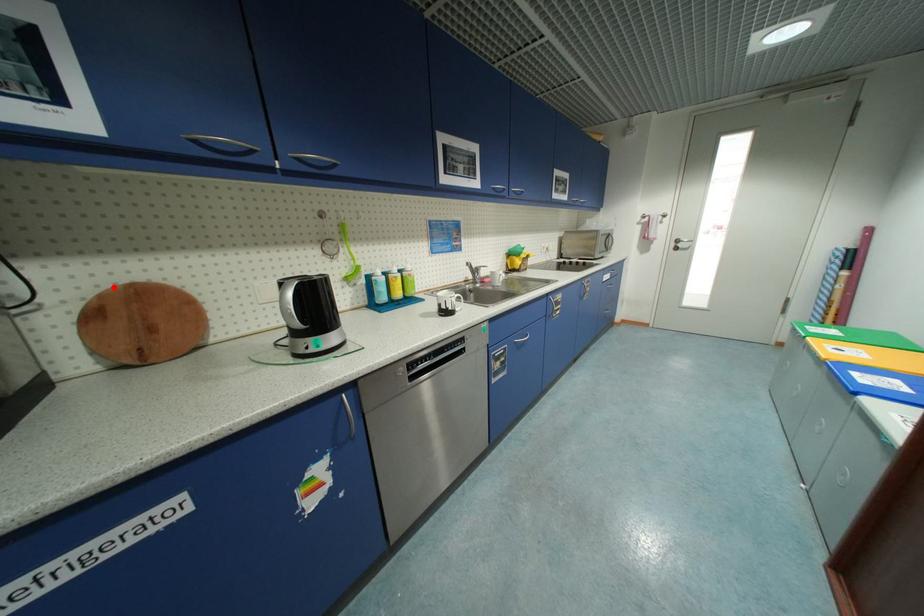
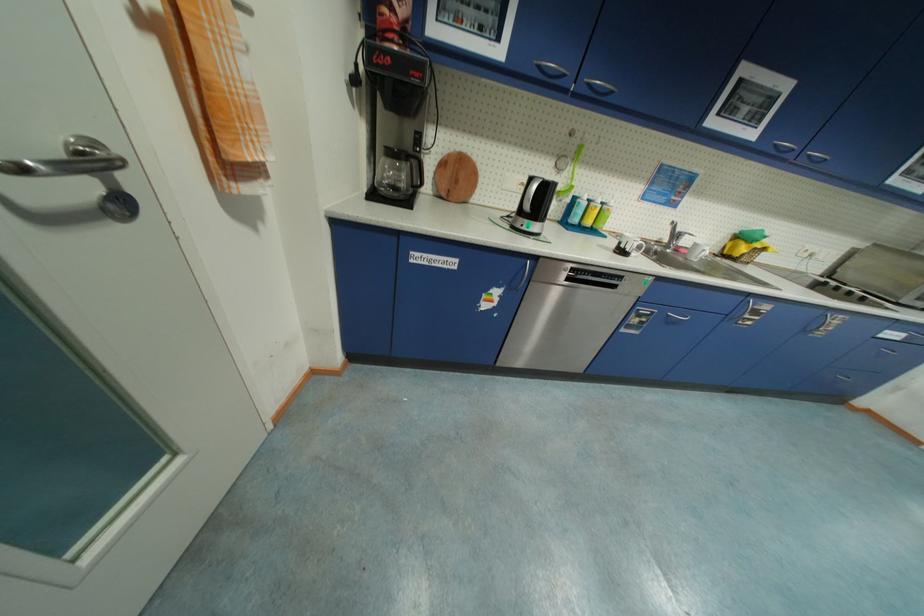
Where in the second image is the point corresponding to the highlighted location from the first image?

(457, 151)